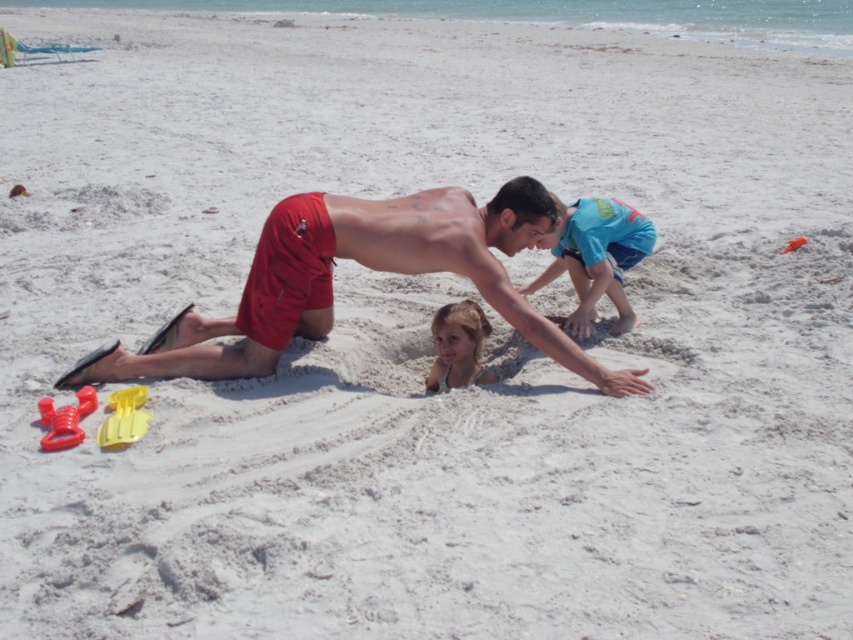
Question: Among these objects, which one is nearest to the camera?

Choices:
 (A) smooth blonde hair at center
 (B) blue cotton shirt at center

Answer: (A)

Question: Where is blue cotton shirt at center located in relation to rubber yellow shovel at lower left in the image?

Choices:
 (A) left
 (B) right

Answer: (B)

Question: Is blue cotton shirt at center above yellow plastic shovel at lower left?

Choices:
 (A) no
 (B) yes

Answer: (B)

Question: Does red shorts at center appear on the right side of yellow plastic shovel at lower left?

Choices:
 (A) yes
 (B) no

Answer: (A)

Question: Estimate the real-world distances between objects in this image. Which object is closer to the orange plastic shovel at center?

Choices:
 (A) yellow plastic shovel at lower left
 (B) rubber yellow shovel at lower left

Answer: (A)

Question: Which of the following is the farthest from the observer?

Choices:
 (A) yellow plastic shovel at lower left
 (B) smooth blonde hair at center
 (C) red shorts at center

Answer: (B)